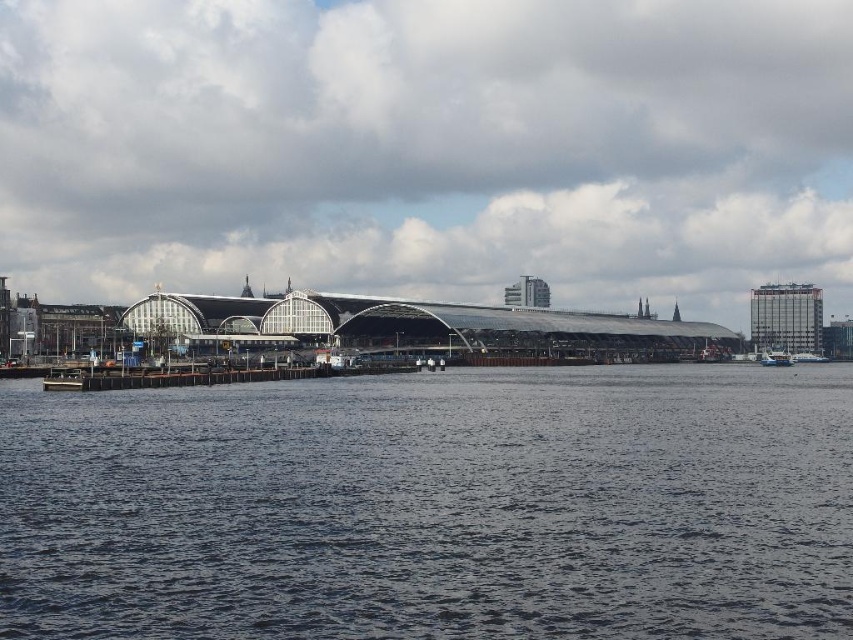
Question: Is dark blue water at center thinner than metallic silver boat at lower right?

Choices:
 (A) yes
 (B) no

Answer: (B)

Question: Which object appears farthest from the camera in this image?

Choices:
 (A) transparent glass building at center
 (B) white glossy boat at lower right

Answer: (A)

Question: Is metallic silver boat at lower right to the left of white glossy boat at lower right from the viewer's perspective?

Choices:
 (A) no
 (B) yes

Answer: (B)

Question: Is metallic silver boat at lower right above white glossy boat at lower right?

Choices:
 (A) yes
 (B) no

Answer: (A)

Question: Among these points, which one is farthest from the camera?

Choices:
 (A) (772, 353)
 (B) (129, 540)
 (C) (808, 362)

Answer: (A)

Question: Which point is closer to the camera?

Choices:
 (A) (811, 353)
 (B) (517, 547)
 (C) (801, 163)
 (D) (775, 349)

Answer: (B)